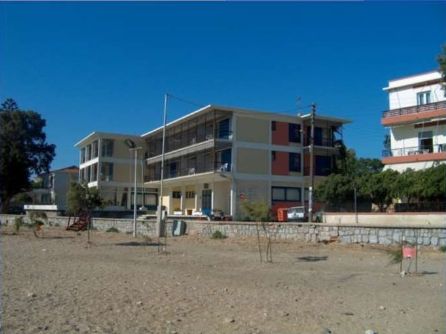
This screenshot has height=334, width=446. Find the location of `wall`. wall is located at coordinates (348, 235).